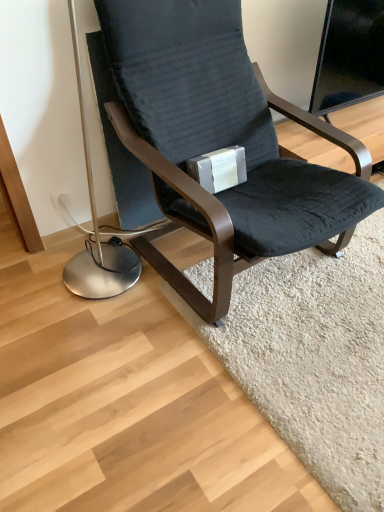
What are the coordinates of `matte black chair at center` in the screenshot? It's located at (221, 141).

What is the approximate width of matte black chair at center?

matte black chair at center is 34.85 inches wide.

What do you see at coordinates (221, 141) in the screenshot?
I see `matte black chair at center` at bounding box center [221, 141].

From the picture: In order to face matte black chair at center, should I rotate leftwards or rightwards?

You should look right and rotate roughly 7.277 degrees.

Locate an element on the screen. Image resolution: width=384 pixels, height=512 pixels. matte black chair at center is located at coordinates coord(221,141).